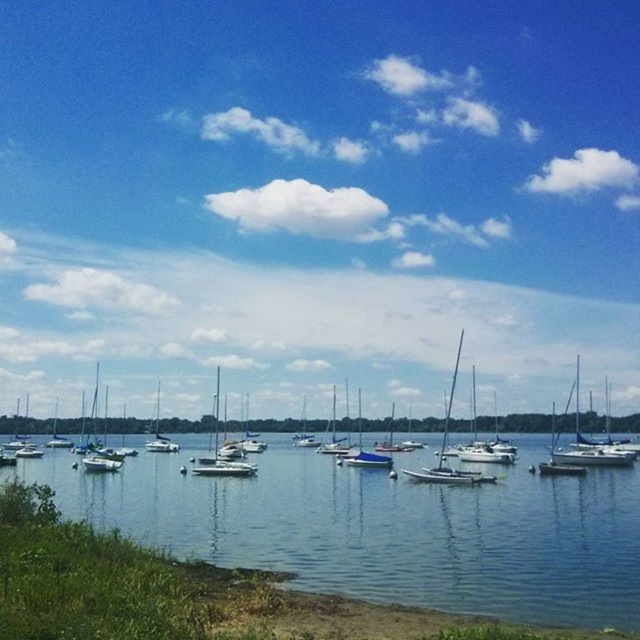
Does white sailboat at right come behind white matte sailboat at lower left?

No, it is in front of white matte sailboat at lower left.

Image resolution: width=640 pixels, height=640 pixels. What are the coordinates of `white sailboat at right` in the screenshot? It's located at (586, 442).

You are a GUI agent. You are given a task and a screenshot of the screen. Output one action in this format:
    pyautogui.click(x=<x>, y=<y>)
    Task: Click on the white sailboat at right
    The height and width of the screenshot is (640, 640).
    Given the screenshot: What is the action you would take?
    pyautogui.click(x=586, y=442)

Based on the photo, does clear blue water at lower center lie in front of white matte sailboat at left?

That is True.

Between clear blue water at lower center and white matte sailboat at left, which one appears on the left side from the viewer's perspective?

From the viewer's perspective, white matte sailboat at left appears more on the left side.

Between point (122, 477) and point (108, 454), which one is positioned in front?

Point (122, 477) is in front.

This screenshot has width=640, height=640. In order to click on clear blue water at lower center in this screenshot , I will do `click(385, 529)`.

Does clear blue water at lower center have a lesser height compared to white sailboat at right?

Correct, clear blue water at lower center is not as tall as white sailboat at right.

Measure the distance between clear blue water at lower center and white sailboat at right.

25.67 meters

The image size is (640, 640). Describe the element at coordinates (385, 529) in the screenshot. I see `clear blue water at lower center` at that location.

At what (x,y) coordinates should I click in order to perform the action: click on clear blue water at lower center. Please return your answer as a coordinate pair (x, y). This screenshot has height=640, width=640. Looking at the image, I should click on (385, 529).